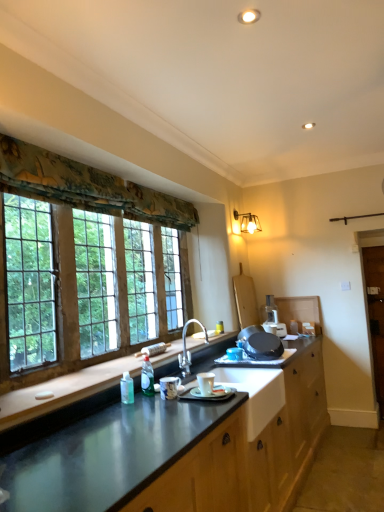
Question: Could metallic gray countertop at lower center, arranged as the 1th countertop when viewed from the top, be considered to be inside brown wooden barn door at right?

Choices:
 (A) yes
 (B) no

Answer: (B)

Question: Is brown wooden barn door at right facing towards metallic gray countertop at lower center, which is the 2th countertop in bottom-to-top order?

Choices:
 (A) no
 (B) yes

Answer: (A)

Question: Can you confirm if brown wooden barn door at right is positioned to the left of metallic gray countertop at lower center, arranged as the 1th countertop when viewed from the top?

Choices:
 (A) yes
 (B) no

Answer: (B)

Question: Is brown wooden barn door at right bigger than metallic gray countertop at lower center, arranged as the 1th countertop when viewed from the top?

Choices:
 (A) no
 (B) yes

Answer: (A)

Question: Does brown wooden barn door at right appear on the right side of metallic gray countertop at lower center, arranged as the 1th countertop when viewed from the top?

Choices:
 (A) yes
 (B) no

Answer: (A)

Question: Can you confirm if brown wooden barn door at right is shorter than metallic gray countertop at lower center, which is the 2th countertop in bottom-to-top order?

Choices:
 (A) yes
 (B) no

Answer: (B)

Question: Does white ceramic sink at center have a lesser width compared to brown wooden barn door at right?

Choices:
 (A) no
 (B) yes

Answer: (A)

Question: Is the depth of white ceramic sink at center greater than that of brown wooden barn door at right?

Choices:
 (A) no
 (B) yes

Answer: (A)

Question: Considering the relative positions of white ceramic sink at center and brown wooden barn door at right in the image provided, is white ceramic sink at center to the left of brown wooden barn door at right from the viewer's perspective?

Choices:
 (A) yes
 (B) no

Answer: (A)

Question: Is brown wooden barn door at right a part of white ceramic sink at center?

Choices:
 (A) yes
 (B) no

Answer: (B)

Question: From a real-world perspective, is white ceramic sink at center over brown wooden barn door at right?

Choices:
 (A) no
 (B) yes

Answer: (B)

Question: Does white ceramic sink at center lie in front of brown wooden barn door at right?

Choices:
 (A) no
 (B) yes

Answer: (B)

Question: Considering the relative sizes of metallic wall sconce at upper right and brown wooden barn door at right in the image provided, is metallic wall sconce at upper right wider than brown wooden barn door at right?

Choices:
 (A) no
 (B) yes

Answer: (B)